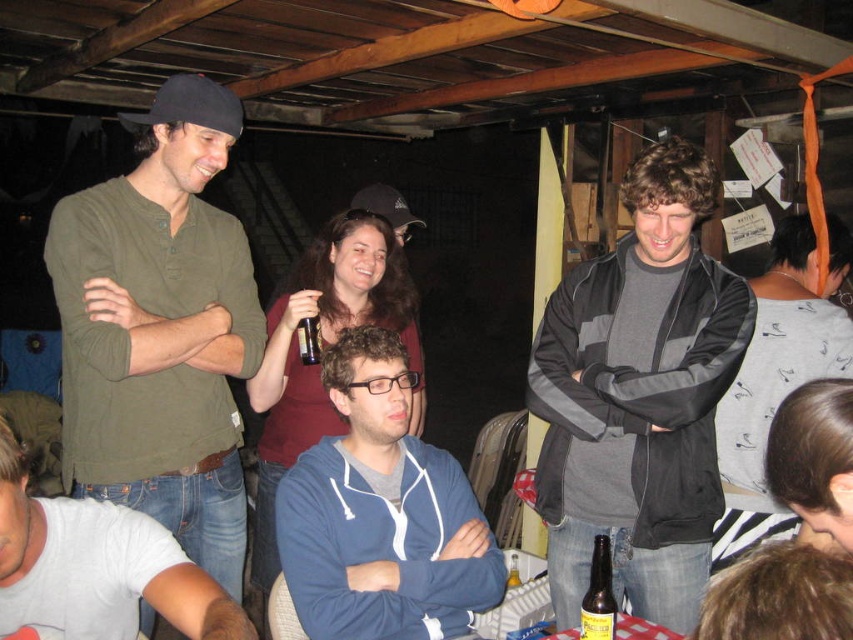
Question: Considering the real-world distances, which object is farthest from the dark gray fleece jacket at center?

Choices:
 (A) black plastic cup at center
 (B) blue fleece jacket at center

Answer: (A)

Question: Among these objects, which one is farthest from the camera?

Choices:
 (A) blue fleece jacket at center
 (B) brown glass bottle at center

Answer: (A)

Question: Is blue fleece jacket at center above brown glass bottle at center?

Choices:
 (A) yes
 (B) no

Answer: (A)

Question: Is gray cotton t-shirt at lower left to the left of black plastic cup at center from the viewer's perspective?

Choices:
 (A) no
 (B) yes

Answer: (B)

Question: Which of these objects is positioned farthest from the black plastic cup at center?

Choices:
 (A) brown glass bottle at center
 (B) blue fleece jacket at center

Answer: (A)

Question: Is blue fleece jacket at center smaller than brown glass bottle at center?

Choices:
 (A) yes
 (B) no

Answer: (B)